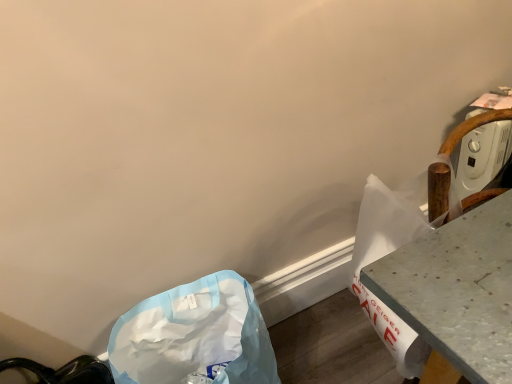
Question: Is metallic gray table at right shorter than blue plastic bag at lower left?

Choices:
 (A) no
 (B) yes

Answer: (A)

Question: Can you confirm if metallic gray table at right is thinner than blue plastic bag at lower left?

Choices:
 (A) yes
 (B) no

Answer: (A)

Question: Is metallic gray table at right far from blue plastic bag at lower left?

Choices:
 (A) yes
 (B) no

Answer: (B)

Question: From the image's perspective, is metallic gray table at right on top of blue plastic bag at lower left?

Choices:
 (A) yes
 (B) no

Answer: (A)

Question: From a real-world perspective, does metallic gray table at right stand above blue plastic bag at lower left?

Choices:
 (A) no
 (B) yes

Answer: (B)

Question: Is metallic gray table at right looking in the opposite direction of blue plastic bag at lower left?

Choices:
 (A) yes
 (B) no

Answer: (B)

Question: Is blue plastic bag at lower left positioned behind metallic gray table at right?

Choices:
 (A) no
 (B) yes

Answer: (B)

Question: Is blue plastic bag at lower left not within metallic gray table at right?

Choices:
 (A) no
 (B) yes

Answer: (B)

Question: Does blue plastic bag at lower left have a larger size compared to metallic gray table at right?

Choices:
 (A) no
 (B) yes

Answer: (A)

Question: Is blue plastic bag at lower left looking in the opposite direction of metallic gray table at right?

Choices:
 (A) no
 (B) yes

Answer: (A)

Question: Can you confirm if blue plastic bag at lower left is shorter than metallic gray table at right?

Choices:
 (A) yes
 (B) no

Answer: (A)

Question: Is metallic gray table at right located within blue plastic bag at lower left?

Choices:
 (A) no
 (B) yes

Answer: (A)

Question: Considering the positions of blue plastic bag at lower left and metallic gray table at right in the image, is blue plastic bag at lower left taller or shorter than metallic gray table at right?

Choices:
 (A) tall
 (B) short

Answer: (B)